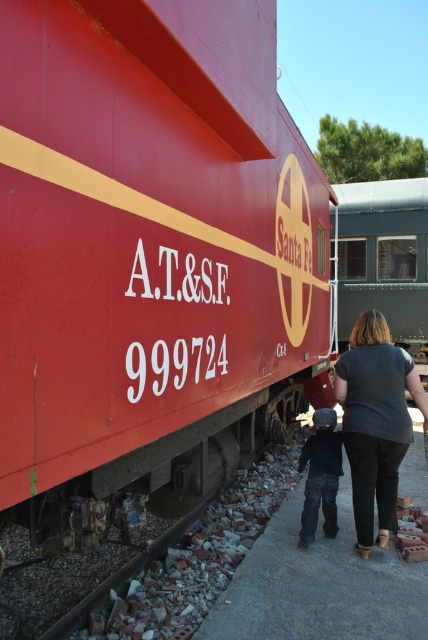
Looking at this image, you are a photographer trying to capture both the matte red train at center and the green matte train car at center in a single shot. Considering their heights, which one should you focus on to ensure both are fully visible in the frame?

Since the matte red train at center is not as tall as the green matte train car at center, you should focus on the green matte train car at center to accommodate its greater height in the frame.

You are at the train station and want to board the green matte train car at center. Which direction should you walk from the matte red train at center to reach it?

The matte red train at center is to the left of the green matte train car at center, so you should walk to the right to reach it.